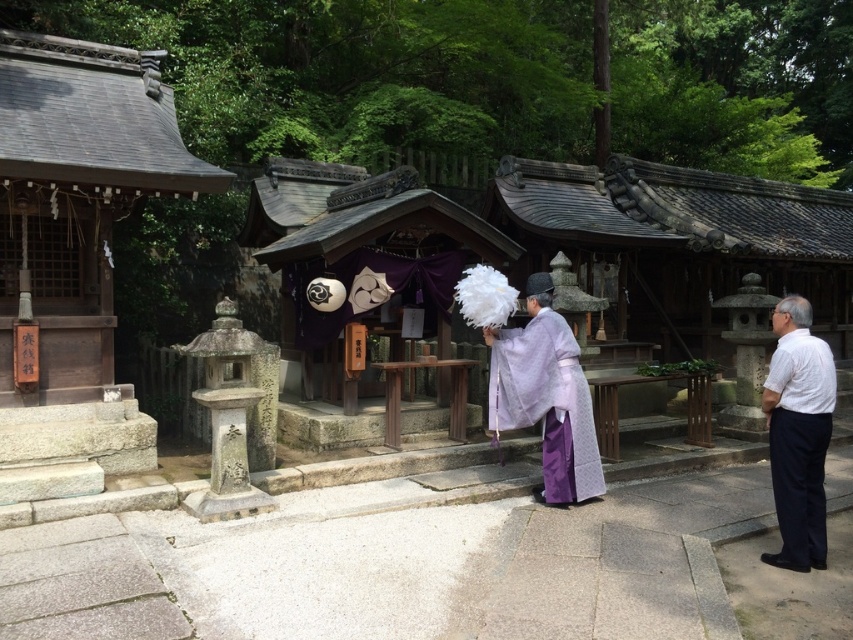
Question: Can you confirm if purple silk kimono at center is wider than purple satin robe at center?

Choices:
 (A) no
 (B) yes

Answer: (A)

Question: Does white cotton shirt at right have a smaller size compared to purple satin robe at center?

Choices:
 (A) yes
 (B) no

Answer: (A)

Question: Which point is closer to the camera?

Choices:
 (A) (492, 346)
 (B) (805, 300)
 (C) (784, 477)

Answer: (C)

Question: Based on their relative distances, which object is nearer to the purple satin robe at center?

Choices:
 (A) white cotton shirt at right
 (B) purple silk kimono at center

Answer: (B)

Question: Can you confirm if purple silk kimono at center is wider than white cotton shirt at right?

Choices:
 (A) no
 (B) yes

Answer: (B)

Question: Considering the real-world distances, which object is farthest from the white cotton shirt at right?

Choices:
 (A) purple satin robe at center
 (B) purple silk kimono at center

Answer: (B)